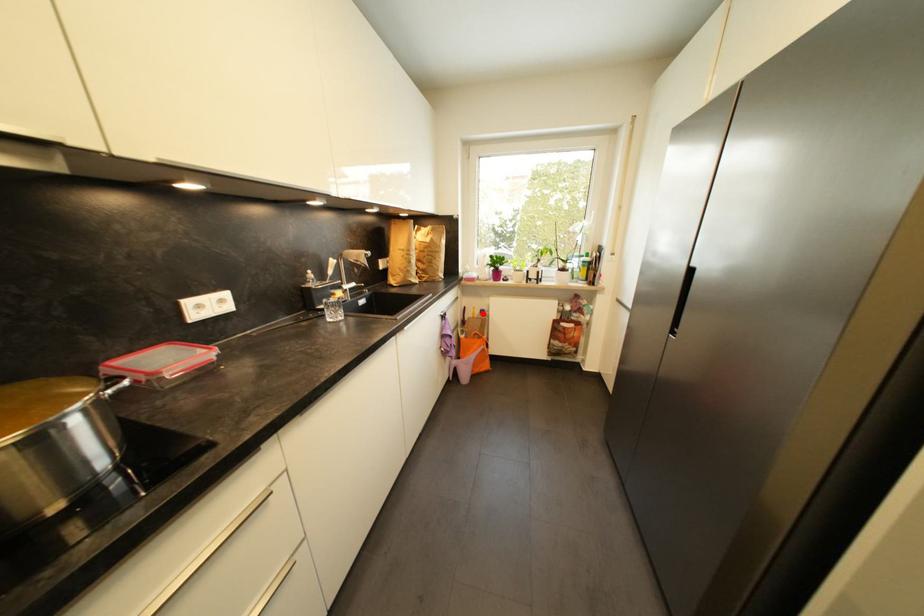
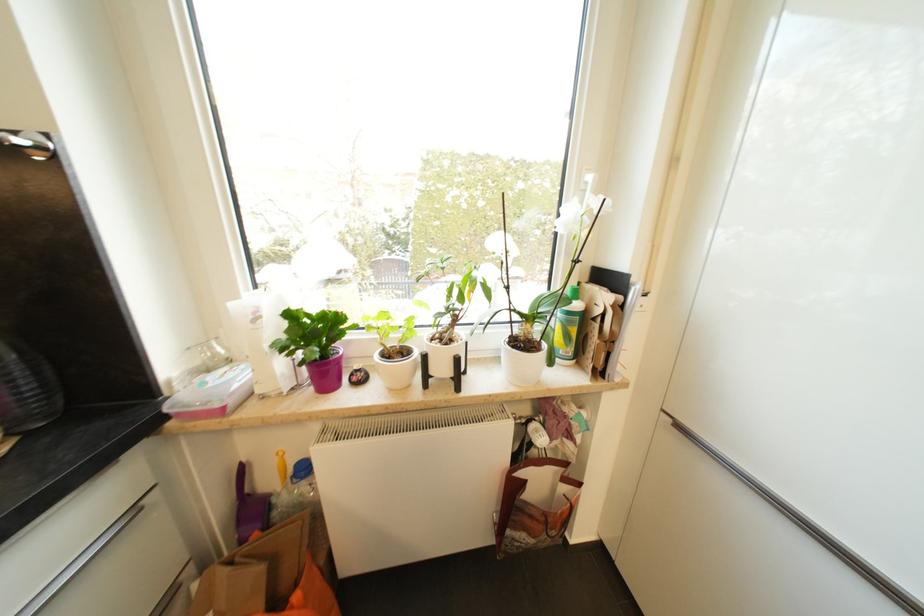
Locate, in the second image, the point that corresponds to the highlighted location in the first image.

(295, 471)